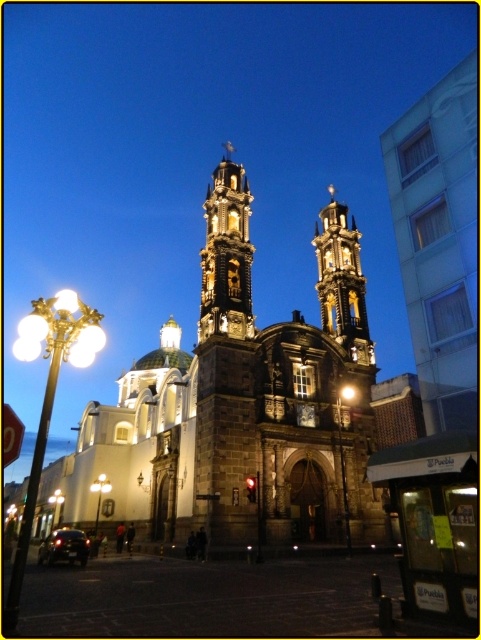
You are standing in front of the historic church at dusk. You want to take a photo of the golden ornate bell tower at center. If your camera has a maximum focus range of 200 feet, will it be able to capture the tower clearly?

The golden ornate bell tower at center is 196.80 feet away from the viewer. Since the camera can focus up to 200 feet, it will be able to capture the tower clearly within its range.

You are an architect evaluating the church design. Based on the image, which bell tower is taller between the golden ornate bell tower at center and the dark gray stone bell tower at center?

The golden ornate bell tower at center is taller than the dark gray stone bell tower at center according to the description.

Consider the image. You are a drone operator tasked with capturing aerial footage of the golden ornate bell tower at center and the dark gray stone bell tower at center. The drone has a maximum flight range of 25 meters. Can the drone safely capture footage of both bell towers without exceeding its range?

The distance between the golden ornate bell tower at center and the dark gray stone bell tower at center is 20.70 meters. Since the drone has a maximum flight range of 25 meters, it can safely capture footage of both bell towers without exceeding its range.